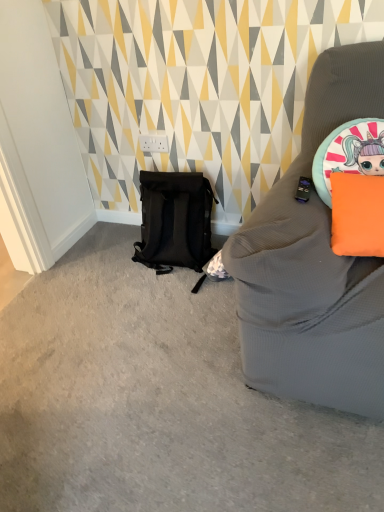
Where is `black matte backpack at lower left`? The width and height of the screenshot is (384, 512). black matte backpack at lower left is located at coordinates (x=175, y=221).

What do you see at coordinates (175, 221) in the screenshot? This screenshot has width=384, height=512. I see `black matte backpack at lower left` at bounding box center [175, 221].

What do you see at coordinates (357, 215) in the screenshot? I see `orange matte pillow at upper right` at bounding box center [357, 215].

Where is `orange matte pillow at upper right`? orange matte pillow at upper right is located at coordinates (357, 215).

Where is `black matte backpack at lower left`? black matte backpack at lower left is located at coordinates (175, 221).

Considering the positions of objects black matte backpack at lower left and orange matte pillow at upper right in the image provided, who is more to the right, black matte backpack at lower left or orange matte pillow at upper right?

orange matte pillow at upper right is more to the right.

Is black matte backpack at lower left further to camera compared to orange matte pillow at upper right?

Yes, black matte backpack at lower left is further from the camera.

Which is farther from the camera, [151,256] or [332,178]?

Point [151,256]

From the image's perspective, who appears lower, black matte backpack at lower left or orange matte pillow at upper right?

orange matte pillow at upper right appears lower in the image.

From a real-world perspective, is black matte backpack at lower left positioned over orange matte pillow at upper right based on gravity?

No.

Is black matte backpack at lower left wider than orange matte pillow at upper right?

Yes.

Considering the sizes of objects black matte backpack at lower left and orange matte pillow at upper right in the image provided, who is taller, black matte backpack at lower left or orange matte pillow at upper right?

With more height is black matte backpack at lower left.

Is black matte backpack at lower left bigger or smaller than orange matte pillow at upper right?

Considering their sizes, black matte backpack at lower left takes up more space than orange matte pillow at upper right.

Is black matte backpack at lower left located outside orange matte pillow at upper right?

black matte backpack at lower left is positioned outside orange matte pillow at upper right.

Would you say black matte backpack at lower left is a long distance from orange matte pillow at upper right?

They are positioned close to each other.

Looking at this image, is black matte backpack at lower left facing away from orange matte pillow at upper right?

black matte backpack at lower left is not turned away from orange matte pillow at upper right.

How different are the orientations of black matte backpack at lower left and orange matte pillow at upper right in degrees?

7.8 degrees separate the facing orientations of black matte backpack at lower left and orange matte pillow at upper right.

How far apart are black matte backpack at lower left and orange matte pillow at upper right?

black matte backpack at lower left is 84.47 centimeters from orange matte pillow at upper right.

The width and height of the screenshot is (384, 512). I want to click on pillow lying below the black matte backpack at lower left (from the image's perspective), so click(357, 215).

Considering the positions of objects orange matte pillow at upper right and black matte backpack at lower left in the image provided, who is more to the left, orange matte pillow at upper right or black matte backpack at lower left?

From the viewer's perspective, black matte backpack at lower left appears more on the left side.

Is orange matte pillow at upper right in front of or behind black matte backpack at lower left in the image?

Visually, orange matte pillow at upper right is located in front of black matte backpack at lower left.

Which point is more forward, (x=346, y=176) or (x=171, y=241)?

Positioned in front is point (x=346, y=176).

From the image's perspective, is orange matte pillow at upper right under black matte backpack at lower left?

Indeed, from the image's perspective, orange matte pillow at upper right is shown beneath black matte backpack at lower left.

Consider the image. From a real-world perspective, is orange matte pillow at upper right beneath black matte backpack at lower left?

No, from a real-world perspective, orange matte pillow at upper right is not beneath black matte backpack at lower left.

Considering the sizes of objects orange matte pillow at upper right and black matte backpack at lower left in the image provided, who is wider, orange matte pillow at upper right or black matte backpack at lower left?

With larger width is black matte backpack at lower left.

Which of these two, orange matte pillow at upper right or black matte backpack at lower left, stands shorter?

Standing shorter between the two is orange matte pillow at upper right.

Which of these two, orange matte pillow at upper right or black matte backpack at lower left, is bigger?

Bigger between the two is black matte backpack at lower left.

Would you say orange matte pillow at upper right is inside or outside black matte backpack at lower left?

orange matte pillow at upper right is outside black matte backpack at lower left.

Would you consider orange matte pillow at upper right to be distant from black matte backpack at lower left?

They are positioned close to each other.

Could you tell me if orange matte pillow at upper right is turned towards black matte backpack at lower left?

No.

What's the angular difference between orange matte pillow at upper right and black matte backpack at lower left's facing directions?

The angle between the facing direction of orange matte pillow at upper right and the facing direction of black matte backpack at lower left is 7.8 degrees.

Measure the distance between orange matte pillow at upper right and black matte backpack at lower left.

orange matte pillow at upper right is 33.25 inches away from black matte backpack at lower left.

There is a black matte backpack at lower left. Where is `pillow above it (from a real-world perspective)`? pillow above it (from a real-world perspective) is located at coordinates (357, 215).

I want to click on pillow that is on the right side of black matte backpack at lower left, so click(357, 215).

At what (x,y) coordinates should I click in order to perform the action: click on pillow located below the black matte backpack at lower left (from the image's perspective). Please return your answer as a coordinate pair (x, y). Looking at the image, I should click on pos(357,215).